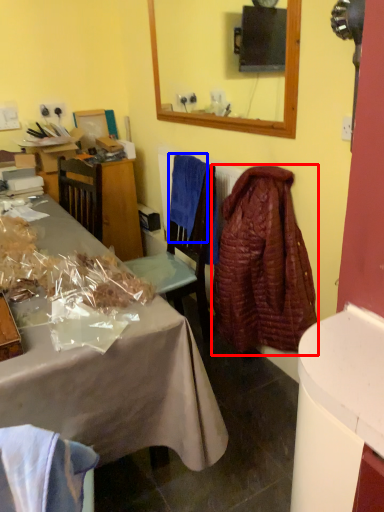
Question: Which point is further to the camera, robe (highlighted by a red box) or cloth (highlighted by a blue box)?

Choices:
 (A) robe
 (B) cloth

Answer: (B)